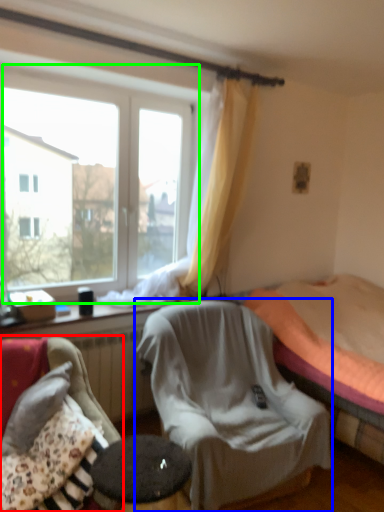
Question: Based on their relative distances, which object is farther from chair (highlighted by a red box)? Choose from chair (highlighted by a blue box) and window (highlighted by a green box).

Choices:
 (A) chair
 (B) window

Answer: (B)